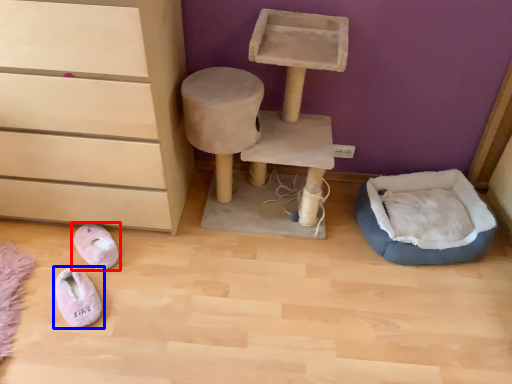
Question: Which object appears farthest to the camera in this image, footwear (highlighted by a red box) or footwear (highlighted by a blue box)?

Choices:
 (A) footwear
 (B) footwear

Answer: (A)